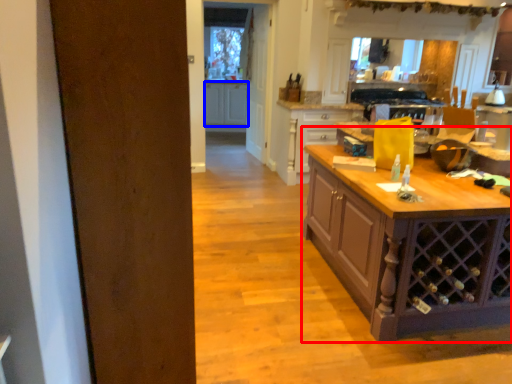
Question: Which object is further to the camera taking this photo, table (highlighted by a red box) or cabinetry (highlighted by a blue box)?

Choices:
 (A) table
 (B) cabinetry

Answer: (B)